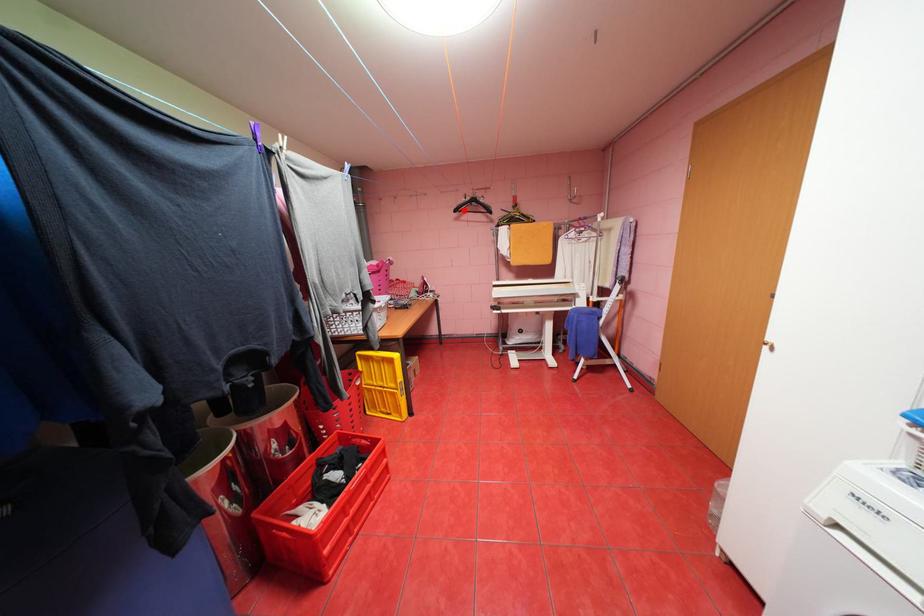
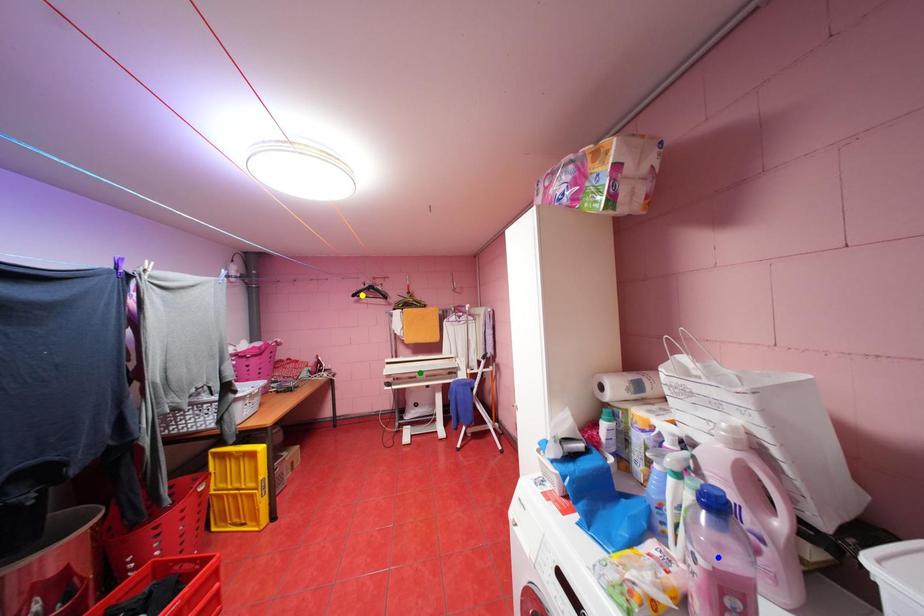
Question: I am providing you with two images of the same scene from different viewpoints. A red point is marked on the first image. You are given multiple points on the second image. Can you choose the point in image 2 that corresponds to the point in image 1?

Choices:
 (A) green point
 (B) yellow point
 (C) blue point

Answer: (B)